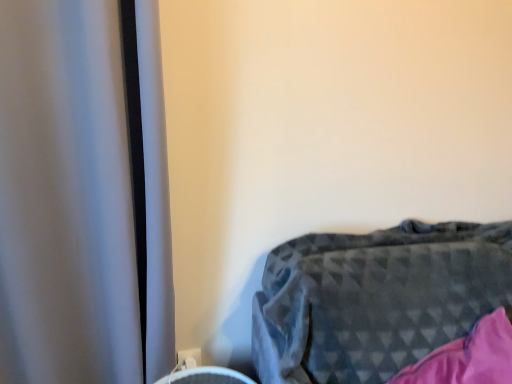
Question: From the image's perspective, is white plastic electric outlet at lower center located above or below dark gray textured blanket at lower right?

Choices:
 (A) above
 (B) below

Answer: (B)

Question: Do you think white plastic electric outlet at lower center is within dark gray textured blanket at lower right, or outside of it?

Choices:
 (A) inside
 (B) outside

Answer: (B)

Question: In the image, is white plastic electric outlet at lower center positioned in front of or behind dark gray textured blanket at lower right?

Choices:
 (A) behind
 (B) front

Answer: (A)

Question: In the image, is dark gray textured blanket at lower right on the left side or the right side of white plastic electric outlet at lower center?

Choices:
 (A) left
 (B) right

Answer: (B)

Question: Considering the positions of dark gray textured blanket at lower right and white plastic electric outlet at lower center in the image, is dark gray textured blanket at lower right taller or shorter than white plastic electric outlet at lower center?

Choices:
 (A) tall
 (B) short

Answer: (A)

Question: Relative to white plastic electric outlet at lower center, is dark gray textured blanket at lower right in front or behind?

Choices:
 (A) front
 (B) behind

Answer: (A)

Question: From a real-world perspective, is dark gray textured blanket at lower right positioned above or below white plastic electric outlet at lower center?

Choices:
 (A) above
 (B) below

Answer: (A)